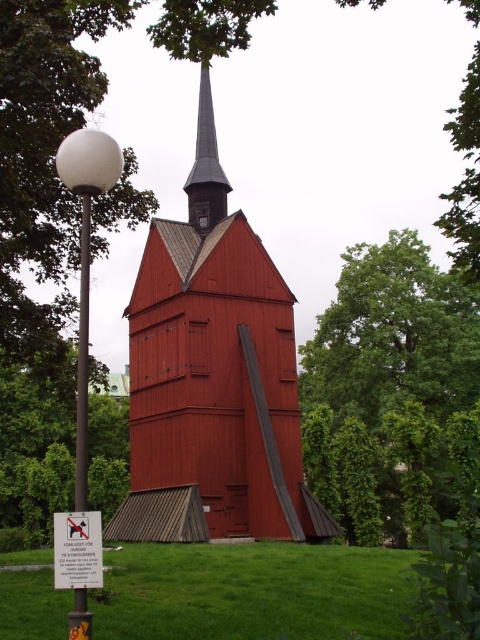
You are planning to place a small doghouse in the scene. The doghouse requires a flat area that is at least as tall as the green leafy tree at left. Can the green grass at center provide enough height for this requirement?

The green grass at center is not as tall as the green leafy tree at left, so it cannot provide enough height for the doghouse requirement.

You are planning to take a photo of the smooth wooden church at center and the white plastic sign at lower left. Since you want both objects to appear equally prominent in the photo, which one should you zoom in on more?

The smooth wooden church at center is larger than the white plastic sign at lower left, so you should zoom in more on the white plastic sign at lower left to make both appear equally prominent in the photo.

In the scene shown: You are standing in front of the red wooden structure and want to place a picnic blanket. Where should you put it to ensure it is on the green grass at center?

Place the picnic blanket at point coordinates of (x=254, y=593) where the green grass at center is located.